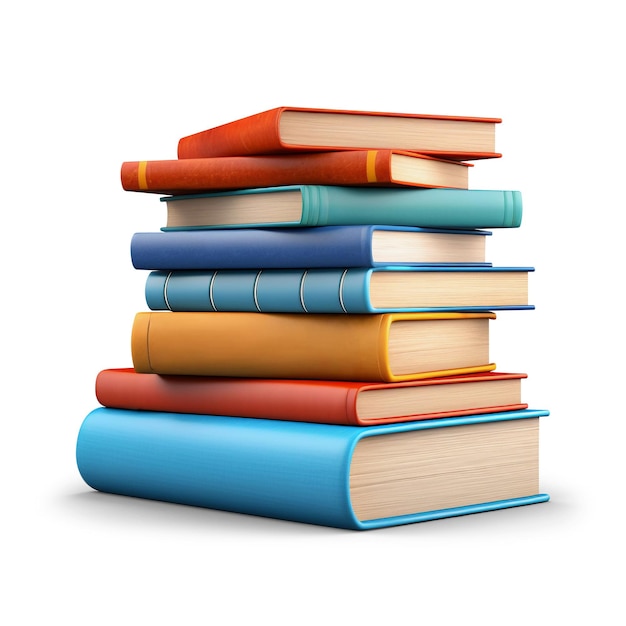
Where is `books`? books is located at coordinates (334, 133), (332, 167), (346, 216), (355, 244), (355, 289), (359, 350), (359, 408), (360, 459).